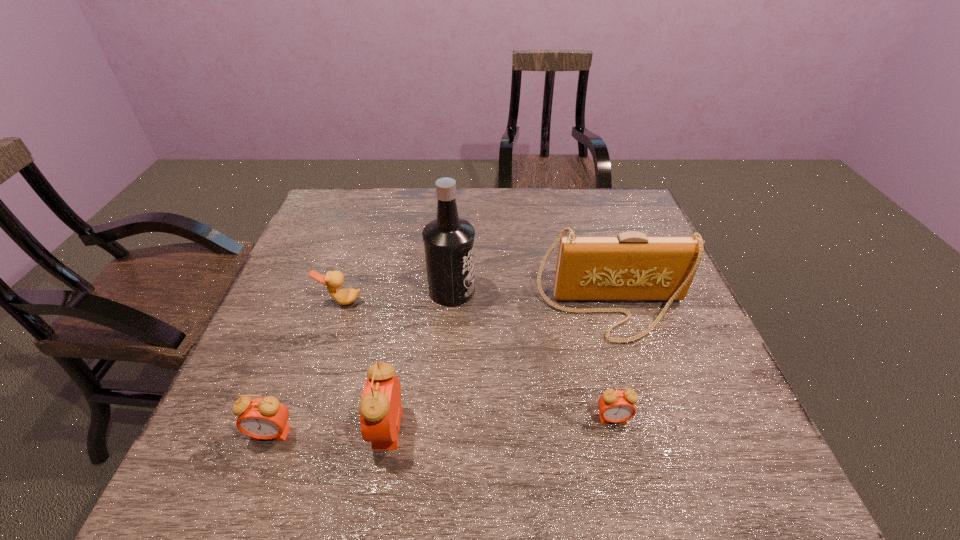
Where is `free space for an extra alarm_clock to achieve even spacing`? This screenshot has height=540, width=960. free space for an extra alarm_clock to achieve even spacing is located at coordinates (501, 423).